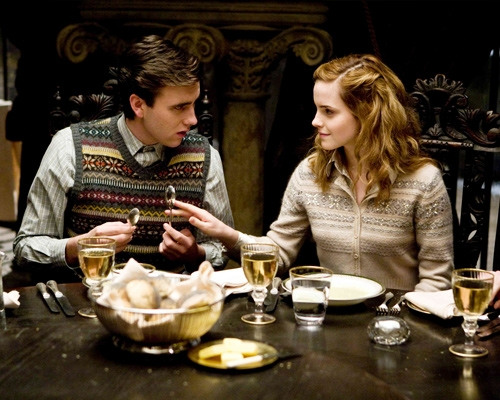
Find the location of a particular element. This screenshot has height=400, width=500. table knives is located at coordinates (65, 305), (51, 307).